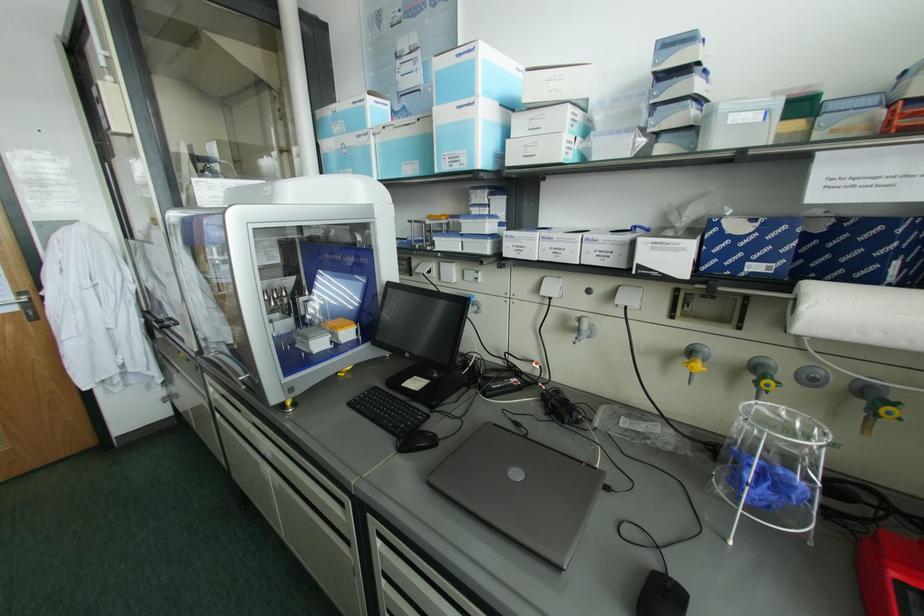
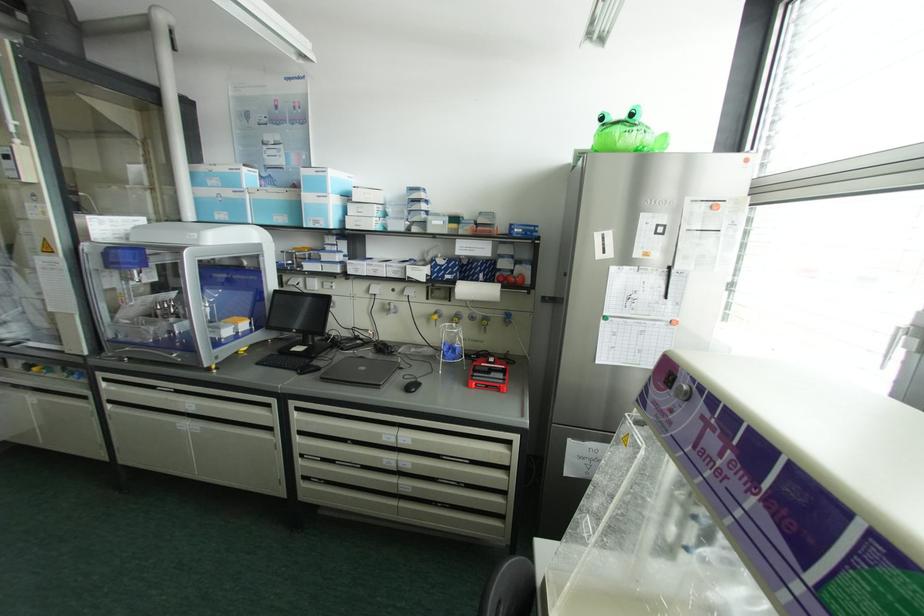
Question: What movement of the cameraman would produce the second image?

Choices:
 (A) Left
 (B) Right
 (C) Forward
 (D) Backward

Answer: (D)